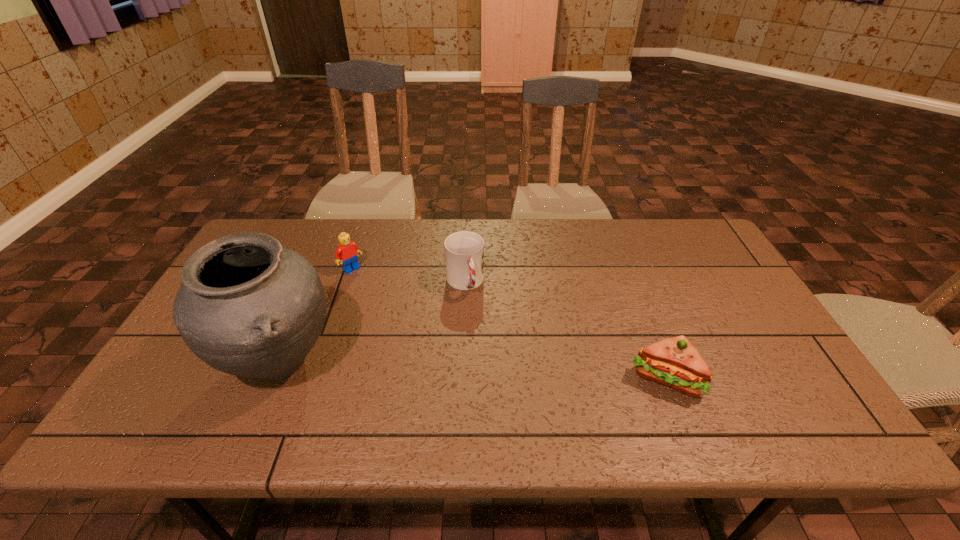
Find the location of `urn`. urn is located at coordinates (249, 307).

Find the location of a particular element. the rightmost object is located at coordinates point(674,362).

At what (x,y) coordinates should I click in order to perform the action: click on Lego. Please return your answer as a coordinate pair (x, y). The height and width of the screenshot is (540, 960). Looking at the image, I should click on (347, 252).

You are a GUI agent. You are given a task and a screenshot of the screen. Output one action in this format:
    pyautogui.click(x=<x>, y=<y>)
    Task: Click on the third object from left to right
    The width and height of the screenshot is (960, 540).
    Given the screenshot: What is the action you would take?
    pyautogui.click(x=464, y=251)

Locate an element on the screen. The image size is (960, 540). free point located 0.160m on the right of the urn is located at coordinates (406, 362).

This screenshot has height=540, width=960. In order to click on free location located on the right of the rightmost object in this screenshot , I will do `click(729, 378)`.

You are a GUI agent. You are given a task and a screenshot of the screen. Output one action in this format:
    pyautogui.click(x=<x>, y=<y>)
    Task: Click on the vacant space situated 0.170m on the face of the Lego
    
    Given the screenshot: What is the action you would take?
    pyautogui.click(x=390, y=303)

Find the location of `free space located on the face of the Lego`. free space located on the face of the Lego is located at coordinates (377, 293).

Identify the location of blank space located on the face of the Lego. The width and height of the screenshot is (960, 540). (390, 303).

The width and height of the screenshot is (960, 540). I want to click on vacant space located on the side of the third object from left to right where the handle is located, so click(x=498, y=377).